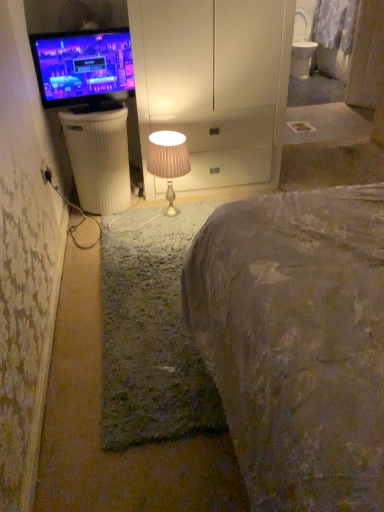
Question: Does matte black tv at left touch matte beige lampshade at center?

Choices:
 (A) yes
 (B) no

Answer: (B)

Question: Does matte black tv at left lie in front of matte beige lampshade at center?

Choices:
 (A) no
 (B) yes

Answer: (B)

Question: Can you confirm if matte black tv at left is taller than matte beige lampshade at center?

Choices:
 (A) yes
 (B) no

Answer: (B)

Question: Is matte black tv at left wider than matte beige lampshade at center?

Choices:
 (A) no
 (B) yes

Answer: (A)

Question: From the image's perspective, would you say matte black tv at left is shown under matte beige lampshade at center?

Choices:
 (A) yes
 (B) no

Answer: (B)

Question: Is matte black tv at left turned away from matte beige lampshade at center?

Choices:
 (A) no
 (B) yes

Answer: (A)

Question: From the image's perspective, would you say matte beige lampshade at center is positioned over black plastic electric outlet at lower left?

Choices:
 (A) no
 (B) yes

Answer: (B)

Question: From a real-world perspective, is matte beige lampshade at center under black plastic electric outlet at lower left?

Choices:
 (A) no
 (B) yes

Answer: (B)

Question: Are matte beige lampshade at center and black plastic electric outlet at lower left beside each other?

Choices:
 (A) no
 (B) yes

Answer: (A)

Question: Is matte beige lampshade at center not close to black plastic electric outlet at lower left?

Choices:
 (A) no
 (B) yes

Answer: (A)

Question: Can you confirm if matte beige lampshade at center is bigger than black plastic electric outlet at lower left?

Choices:
 (A) no
 (B) yes

Answer: (B)

Question: Considering the relative sizes of matte beige lampshade at center and black plastic electric outlet at lower left in the image provided, is matte beige lampshade at center smaller than black plastic electric outlet at lower left?

Choices:
 (A) yes
 (B) no

Answer: (B)

Question: Is black plastic electric outlet at lower left at the back of white ribbed plastic trash bin/can at left?

Choices:
 (A) yes
 (B) no

Answer: (B)